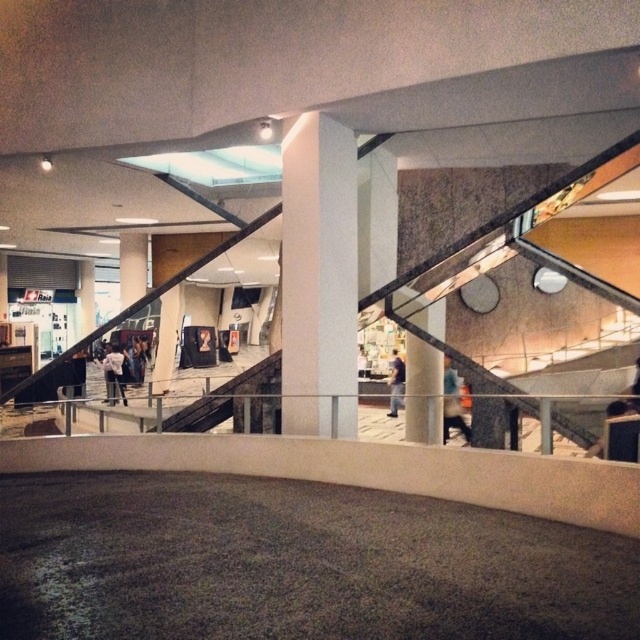
How much distance is there between white smooth pillar at center and white matte jacket at lower left?

white smooth pillar at center and white matte jacket at lower left are 5.22 meters apart.

Is point (310, 189) positioned before point (122, 392)?

Yes, point (310, 189) is in front of point (122, 392).

This screenshot has height=640, width=640. I want to click on white smooth pillar at center, so click(317, 276).

This screenshot has width=640, height=640. What are the coordinates of `white smooth pillar at center` in the screenshot? It's located at (317, 276).

Locate an element on the screen. white smooth pillar at center is located at coordinates (317, 276).

Can you confirm if white smooth pillar at center is positioned above concrete staircase at center?

Correct, white smooth pillar at center is located above concrete staircase at center.

Which is in front, point (339, 413) or point (99, 376)?

Point (339, 413) is in front.

This screenshot has width=640, height=640. I want to click on white smooth pillar at center, so click(317, 276).

Is point (317, 232) positioned before point (451, 369)?

Yes, it is.

Between point (316, 124) and point (465, 435), which one is positioned in front?

Point (316, 124) is more forward.

Identify the location of white smooth pillar at center. (317, 276).

The width and height of the screenshot is (640, 640). Find the location of `white smooth pillar at center`. white smooth pillar at center is located at coordinates (317, 276).